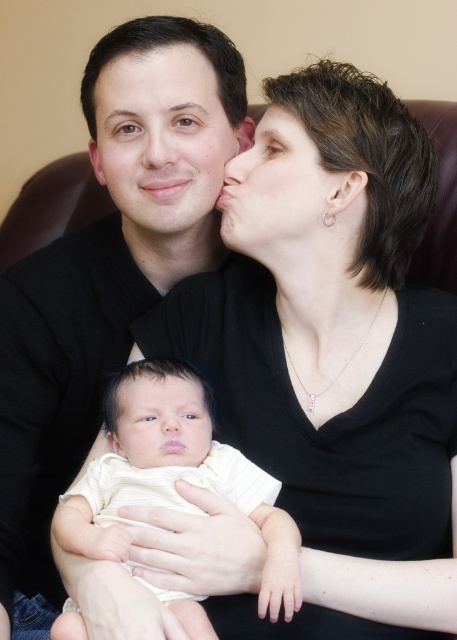
Based on the scene, which object is wider between the yellow striped fabric baby at center and the matte black hair at center?

The yellow striped fabric baby at center is wider than the matte black hair at center.

You are standing in front of the scene and want to determine which of the two points, point [264,525] or point [132,180], is nearer to you. Based on the description, which point is closer?

Point [264,525] is closer to the viewer than point [132,180].